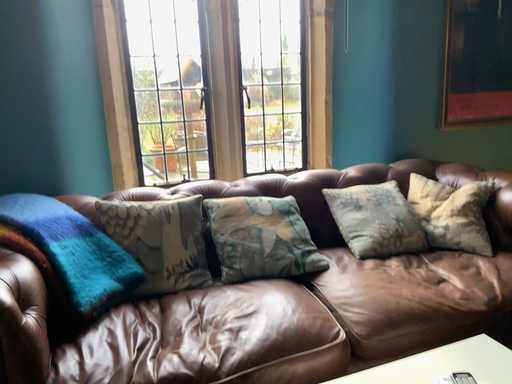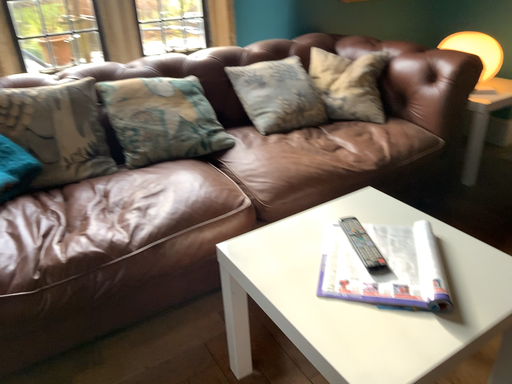
Question: How did the camera likely rotate when shooting the video?

Choices:
 (A) rotated left
 (B) rotated right

Answer: (B)